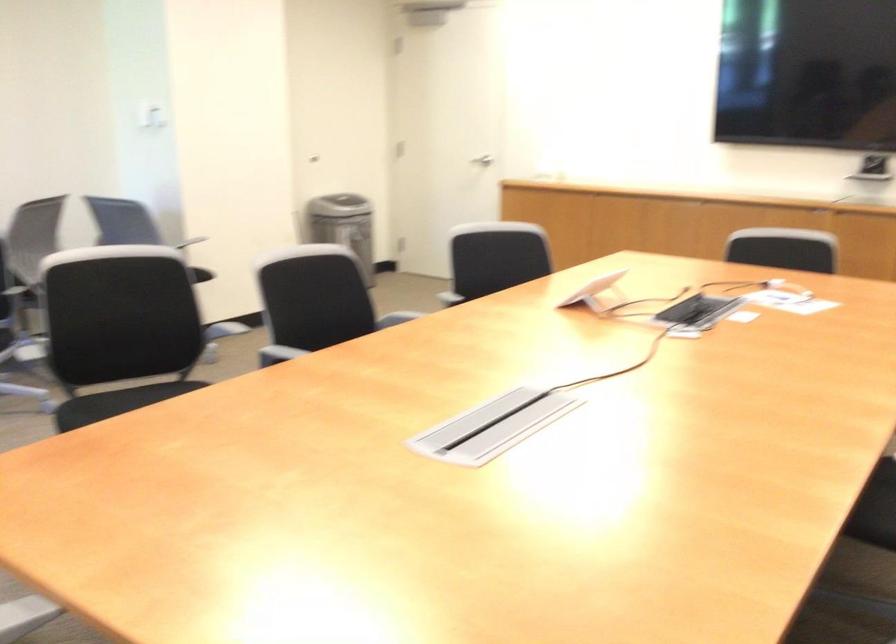
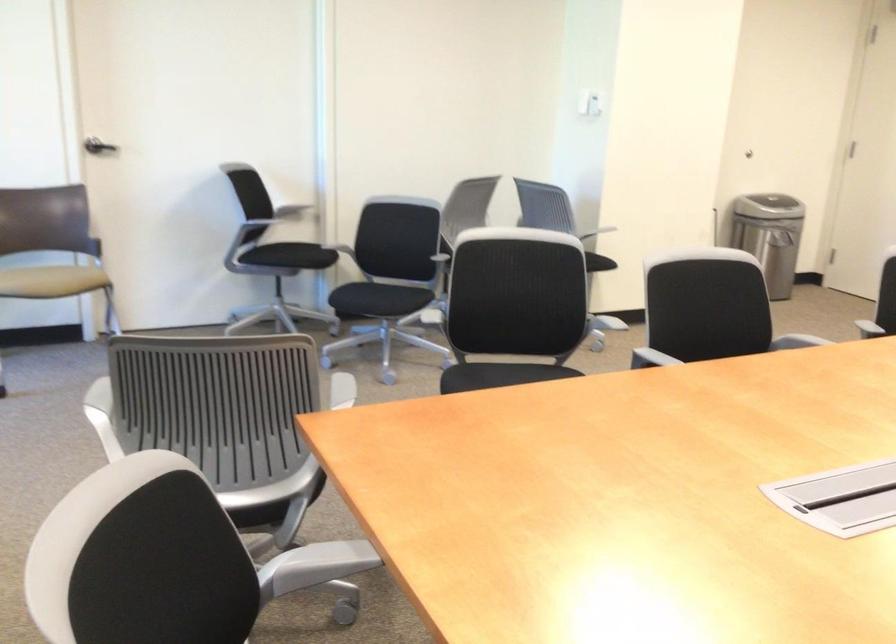
The point at (123, 330) is marked in the first image. Where is the corresponding point in the second image?

(513, 307)